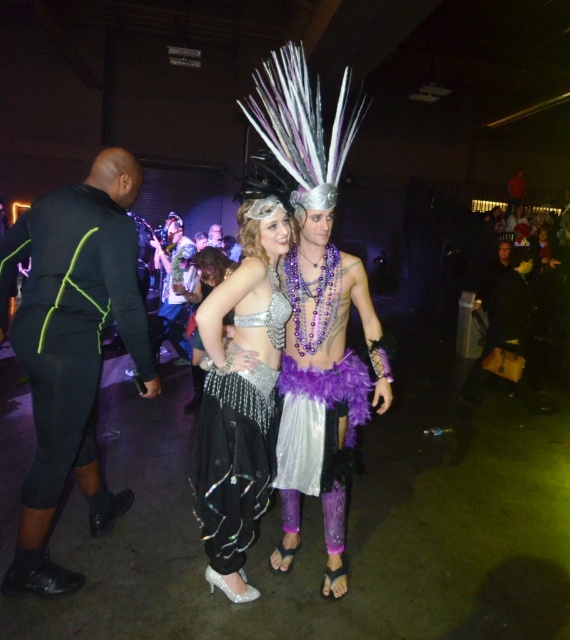
Question: Does shiny metallic vest at center have a lesser width compared to shiny silver headdress at center?

Choices:
 (A) yes
 (B) no

Answer: (B)

Question: Is black leather jacket at center to the left of shiny silver costume at center from the viewer's perspective?

Choices:
 (A) no
 (B) yes

Answer: (B)

Question: Which point is closer to the camera?

Choices:
 (A) (214, 230)
 (B) (295, 509)
 (C) (161, 252)
 (D) (515, 180)

Answer: (B)

Question: Which object is closer to the camera taking this photo?

Choices:
 (A) sparkly silver belly dancer at center
 (B) black neoprene pants at left
 (C) black leather jacket at center
 (D) sparkly silver dress at center

Answer: (A)

Question: Does black leather jacket at center appear over shiny silver costume at center?

Choices:
 (A) yes
 (B) no

Answer: (B)

Question: Which object appears farthest from the camera in this image?

Choices:
 (A) black neoprene pants at left
 (B) shiny metallic vest at center
 (C) shiny silver headdress at center

Answer: (C)